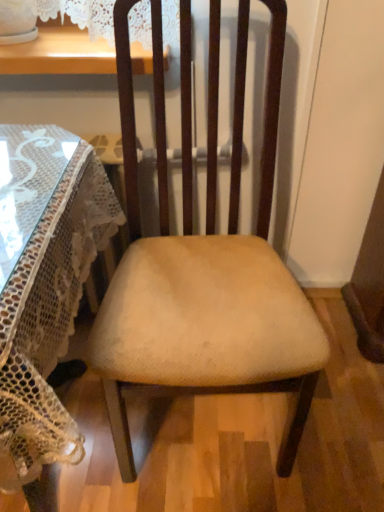
Question: Can we say beige fabric chair at center lies outside transparent glass table at left?

Choices:
 (A) no
 (B) yes

Answer: (B)

Question: Is beige fabric chair at center to the left of transparent glass table at left from the viewer's perspective?

Choices:
 (A) no
 (B) yes

Answer: (A)

Question: Would you say beige fabric chair at center contains transparent glass table at left?

Choices:
 (A) no
 (B) yes

Answer: (A)

Question: Is the depth of beige fabric chair at center greater than that of transparent glass table at left?

Choices:
 (A) no
 (B) yes

Answer: (B)

Question: Is beige fabric chair at center positioned with its back to transparent glass table at left?

Choices:
 (A) no
 (B) yes

Answer: (A)

Question: Are beige fabric chair at center and transparent glass table at left located far from each other?

Choices:
 (A) yes
 (B) no

Answer: (B)

Question: Would you say transparent glass table at left is a long distance from beige fabric chair at center?

Choices:
 (A) yes
 (B) no

Answer: (B)

Question: From a real-world perspective, does transparent glass table at left sit lower than beige fabric chair at center?

Choices:
 (A) no
 (B) yes

Answer: (B)

Question: Can you confirm if transparent glass table at left is shorter than beige fabric chair at center?

Choices:
 (A) yes
 (B) no

Answer: (A)

Question: Does transparent glass table at left lie behind beige fabric chair at center?

Choices:
 (A) no
 (B) yes

Answer: (A)

Question: From the image's perspective, is transparent glass table at left below beige fabric chair at center?

Choices:
 (A) yes
 (B) no

Answer: (A)

Question: Is transparent glass table at left at the right side of beige fabric chair at center?

Choices:
 (A) yes
 (B) no

Answer: (B)

Question: From the image's perspective, relative to transparent glass table at left, is beige fabric chair at center above or below?

Choices:
 (A) below
 (B) above

Answer: (B)